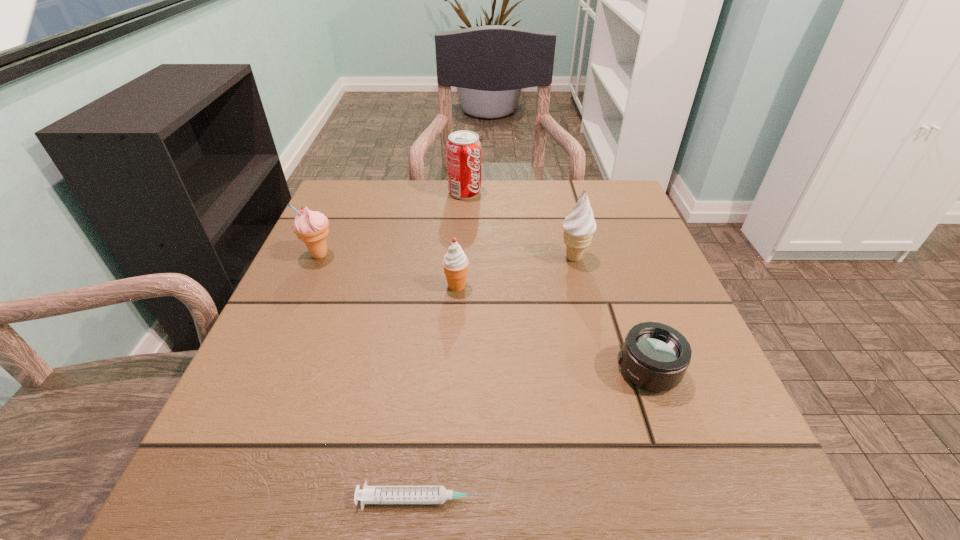
This screenshot has height=540, width=960. What are the coordinates of `free space located 0.190m on the front-facing side of the rightmost icecream` in the screenshot? It's located at (469, 258).

In order to click on vacant space located 0.290m on the front-facing side of the rightmost icecream in this screenshot , I will do `click(423, 258)`.

This screenshot has width=960, height=540. I want to click on vacant point located 0.060m on the left of the farthest object, so click(x=425, y=192).

Where is `blank space located on the right of the leftmost icecream`? This screenshot has width=960, height=540. blank space located on the right of the leftmost icecream is located at coordinates (359, 255).

The width and height of the screenshot is (960, 540). I want to click on vacant space situated on the right of the nearest icecream, so click(x=519, y=286).

Identify the location of blank area located 0.350m on the side of the fifth farthest object with brand markings and control switches. (403, 371).

You are a GUI agent. You are given a task and a screenshot of the screen. Output one action in this format:
    pyautogui.click(x=<x>, y=<y>)
    Task: Click on the free region located on the side of the fifth farthest object with brand markings and control switches
    This screenshot has height=540, width=960.
    Given the screenshot: What is the action you would take?
    pyautogui.click(x=434, y=371)

Find the location of a particular element. The height and width of the screenshot is (540, 960). vacant space located 0.360m on the side of the fifth farthest object with brand markings and control switches is located at coordinates (397, 371).

In order to click on vacant space located 0.050m at the needle end of the syringe in this screenshot , I will do `click(528, 499)`.

This screenshot has height=540, width=960. What are the coordinates of `object present at the far edge` in the screenshot? It's located at (463, 148).